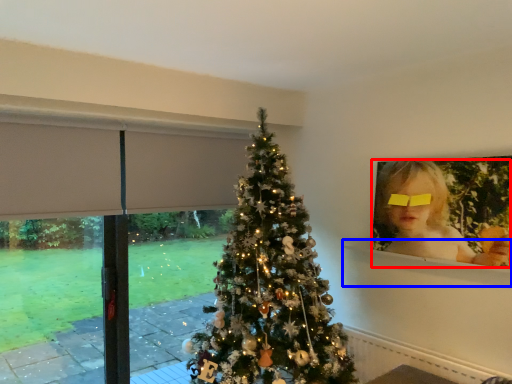
Question: Which object appears farthest to the camera in this image, person (highlighted by a red box) or window sill (highlighted by a blue box)?

Choices:
 (A) person
 (B) window sill

Answer: (B)